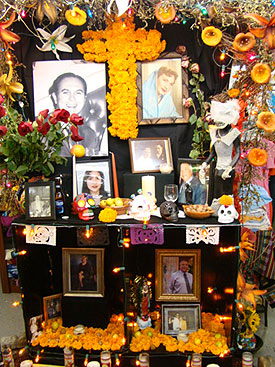
Image resolution: width=275 pixels, height=367 pixels. I want to click on gold frame, so click(x=98, y=292).